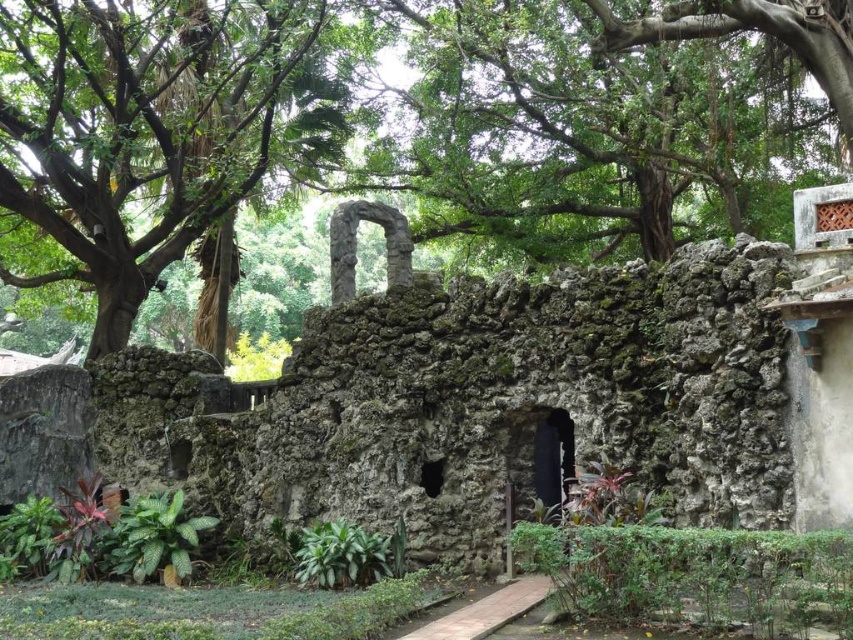
In the scene shown: Measure the distance between green leafy tree at upper center and rough stone ruins at center.

A distance of 69.36 feet exists between green leafy tree at upper center and rough stone ruins at center.

Who is taller, green leafy tree at upper center or rough stone ruins at center?

Standing taller between the two is green leafy tree at upper center.

Which is behind, point (604, 113) or point (820, 464)?

Point (604, 113)

Find the location of a particular element. Image resolution: width=853 pixels, height=640 pixels. green leafy tree at upper center is located at coordinates 407,124.

Is green leafy tree at upper center to the left of green rough bark tree at center from the viewer's perspective?

Correct, you'll find green leafy tree at upper center to the left of green rough bark tree at center.

Identify the location of green leafy tree at upper center. Image resolution: width=853 pixels, height=640 pixels. (407, 124).

Is green rough bark tree at center to the left of green leafy tree at upper left from the viewer's perspective?

Incorrect, green rough bark tree at center is not on the left side of green leafy tree at upper left.

Which is below, green rough bark tree at center or green leafy tree at upper left?

green leafy tree at upper left is below.

This screenshot has height=640, width=853. What do you see at coordinates (607, 113) in the screenshot?
I see `green rough bark tree at center` at bounding box center [607, 113].

Where is `green rough bark tree at center`? The width and height of the screenshot is (853, 640). green rough bark tree at center is located at coordinates (607, 113).